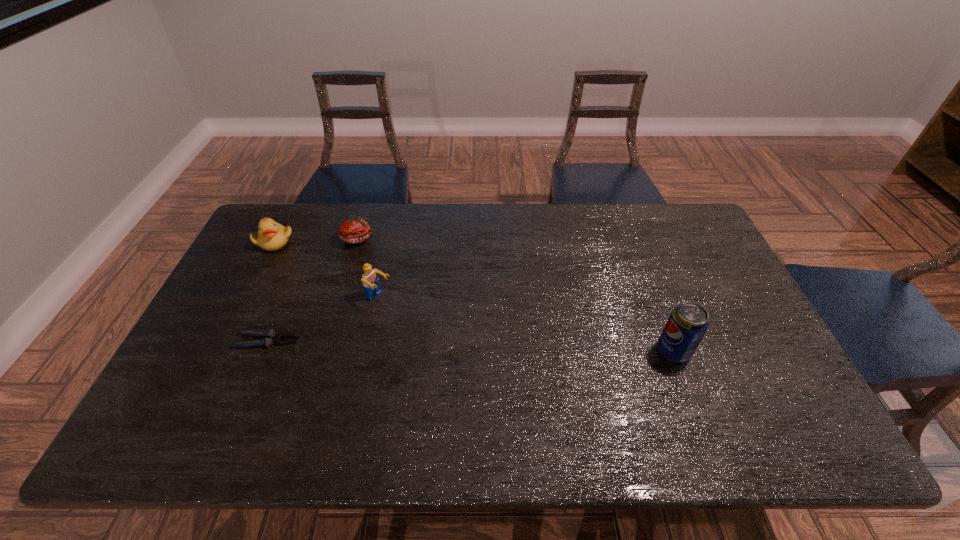
I want to click on pliers, so click(x=270, y=337).

The width and height of the screenshot is (960, 540). I want to click on soda, so click(687, 324).

Where is `the tallest object`? The height and width of the screenshot is (540, 960). the tallest object is located at coordinates (687, 324).

Locate an element on the screen. the third object from right to left is located at coordinates (352, 229).

Identify the location of the fourth object from left to right. The height and width of the screenshot is (540, 960). (370, 280).

Where is `the third nearest object`? Image resolution: width=960 pixels, height=540 pixels. the third nearest object is located at coordinates (370, 280).

Identify the location of duckling. (271, 236).

You are a GUI agent. You are given a task and a screenshot of the screen. Output one action in this format:
    pyautogui.click(x=<x>, y=<y>)
    Task: Click on the vacant space located 0.340m at the gripping part of the shortest object
    
    Given the screenshot: What is the action you would take?
    pyautogui.click(x=424, y=341)

Identify the location of vacant space located 0.200m on the back of the tallest object. (649, 285).

I want to click on free location located 0.370m on the front-facing side of the tomato, so click(420, 319).